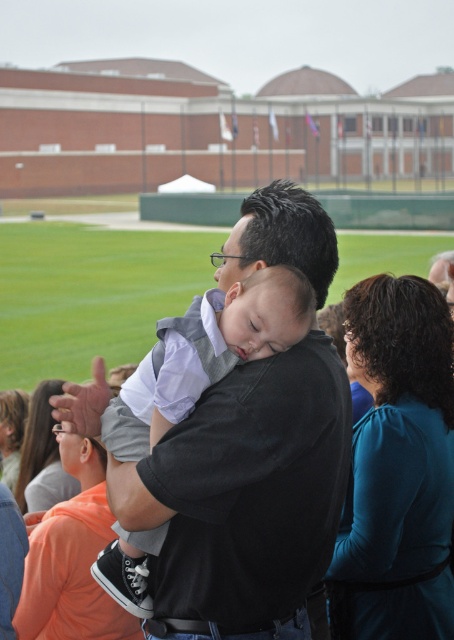
You are organizing a clothing display and need to arrange the teal fabric shirt at right and the teal fabric dress at lower left side by side. Based on their widths, which one should be placed on the left to ensure they fit within the display area without overlapping?

The teal fabric shirt at right is wider than the teal fabric dress at lower left, so placing the shirt on the left and the dress on the right would allow them to fit side by side without overlapping.

You are a photographer at the event and need to capture a photo that includes both the teal fabric shirt at right and the teal fabric shirt at lower left. Which shirt should you position to the left side in your camera frame?

The teal fabric shirt at lower left should be positioned to the left side in your camera frame because the teal fabric shirt at right is on the right side of it.

You are organizing a clothing donation drive and need to categorize shirts by size. You have two shirts in front of you at the event scene described. The black cotton shirt at center and the teal fabric shirt at right. Which shirt has a larger width measurement?

The black cotton shirt at center has a larger width than the teal fabric shirt at right according to the description.